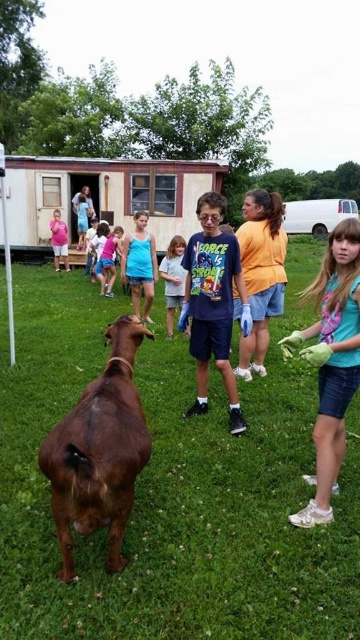
Can you confirm if brown grass at center is smaller than orange cotton shirt at center?

Incorrect, brown grass at center is not smaller in size than orange cotton shirt at center.

Which is in front, point (36, 566) or point (246, 380)?

Point (36, 566)

Is point (2, 516) positioned before point (281, 243)?

Yes.

What are the coordinates of `brown grass at center` in the screenshot? It's located at (173, 486).

Is brown fuzzy goat at lower left below light blue t-shirt at center?

Yes, brown fuzzy goat at lower left is below light blue t-shirt at center.

Is brown fuzzy goat at lower left to the left of light blue t-shirt at center from the viewer's perspective?

Indeed, brown fuzzy goat at lower left is positioned on the left side of light blue t-shirt at center.

The height and width of the screenshot is (640, 360). I want to click on brown fuzzy goat at lower left, so click(99, 451).

Can you confirm if light blue t-shirt at center is taller than orange cotton shirt at center?

In fact, light blue t-shirt at center may be shorter than orange cotton shirt at center.

Is light blue t-shirt at center positioned before orange cotton shirt at center?

Yes, light blue t-shirt at center is in front of orange cotton shirt at center.

Image resolution: width=360 pixels, height=640 pixels. What do you see at coordinates (331, 362) in the screenshot?
I see `light blue t-shirt at center` at bounding box center [331, 362].

Where is `light blue t-shirt at center`? Image resolution: width=360 pixels, height=640 pixels. light blue t-shirt at center is located at coordinates (331, 362).